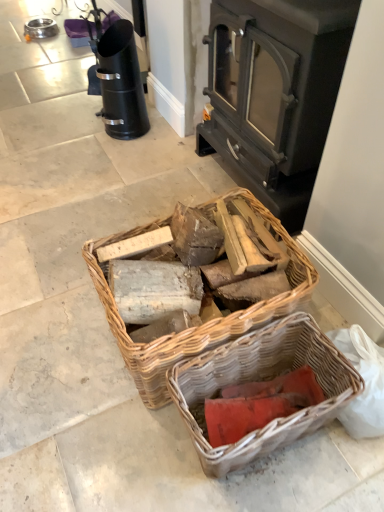
The image size is (384, 512). Find the location of `spots to the right of red cardboard at lower center`. spots to the right of red cardboard at lower center is located at coordinates (316, 454).